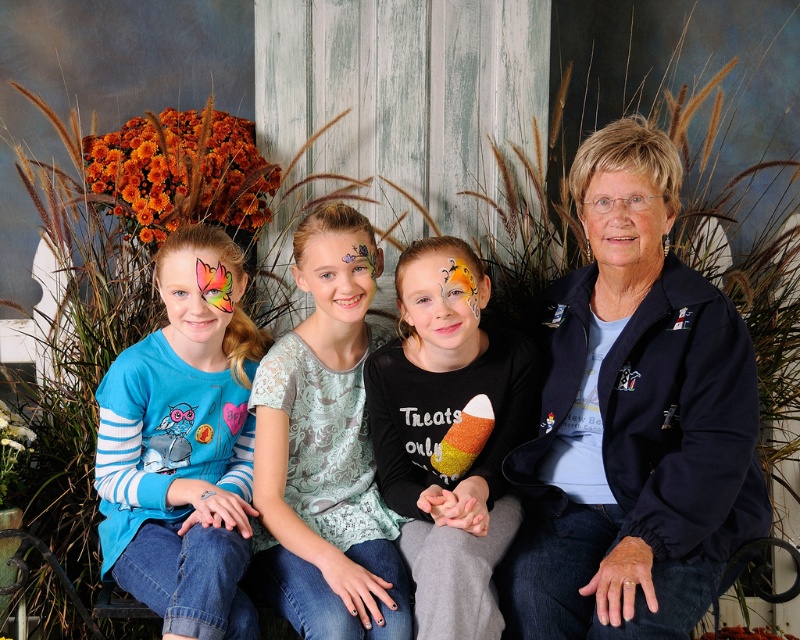
You are a photographer taking a picture of the group. You notice the matte black jacket at center and the lace fabric shirt at center. Which clothing item is positioned higher in the image?

The matte black jacket at center is located above the lace fabric shirt at center, so it is positioned higher in the image.

You are a photographer setting up a tripod to take a group photo of the people in the scene. You need to ensure that both the matte black jacket at center and the matte black jacket at upper right are fully visible in the frame. Based on their sizes, which jacket should you position closer to the camera to maintain their visibility?

The matte black jacket at center is taller than the matte black jacket at upper right, so positioning the taller matte black jacket at center closer to the camera will help ensure both are fully visible in the frame.